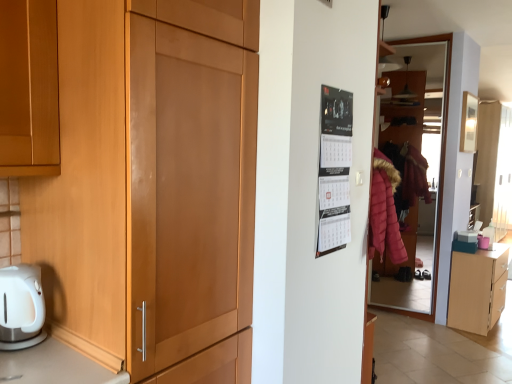
Question: Is black paper calendar at upper right further to camera compared to matte glass door at right?

Choices:
 (A) no
 (B) yes

Answer: (A)

Question: Is black paper calendar at upper right at the right side of matte glass door at right?

Choices:
 (A) no
 (B) yes

Answer: (A)

Question: Would you say black paper calendar at upper right is a long distance from matte glass door at right?

Choices:
 (A) yes
 (B) no

Answer: (A)

Question: From the image's perspective, would you say black paper calendar at upper right is positioned over matte glass door at right?

Choices:
 (A) no
 (B) yes

Answer: (B)

Question: Considering the relative sizes of black paper calendar at upper right and matte glass door at right in the image provided, is black paper calendar at upper right bigger than matte glass door at right?

Choices:
 (A) yes
 (B) no

Answer: (B)

Question: Is light wood cabinet at lower right wider or thinner than matte glass door at right?

Choices:
 (A) thin
 (B) wide

Answer: (B)

Question: Is light wood cabinet at lower right inside the boundaries of matte glass door at right, or outside?

Choices:
 (A) outside
 (B) inside

Answer: (A)

Question: In terms of size, does light wood cabinet at lower right appear bigger or smaller than matte glass door at right?

Choices:
 (A) small
 (B) big

Answer: (B)

Question: In the image, is light wood cabinet at lower right on the left side or the right side of matte glass door at right?

Choices:
 (A) right
 (B) left

Answer: (A)

Question: Considering the relative positions of matte glass door at right and matte wood cupboard at left in the image provided, is matte glass door at right to the left or to the right of matte wood cupboard at left?

Choices:
 (A) left
 (B) right

Answer: (B)

Question: Is matte glass door at right situated inside matte wood cupboard at left or outside?

Choices:
 (A) outside
 (B) inside

Answer: (A)

Question: Is point (399, 71) closer or farther from the camera than point (152, 369)?

Choices:
 (A) farther
 (B) closer

Answer: (A)

Question: Considering the positions of matte glass door at right and matte wood cupboard at left in the image, is matte glass door at right bigger or smaller than matte wood cupboard at left?

Choices:
 (A) small
 (B) big

Answer: (A)

Question: Which is correct: matte wood cupboard at left is inside light wood cabinet at lower right, or outside of it?

Choices:
 (A) outside
 (B) inside

Answer: (A)

Question: Is point (188, 279) positioned closer to the camera than point (484, 327)?

Choices:
 (A) closer
 (B) farther

Answer: (A)